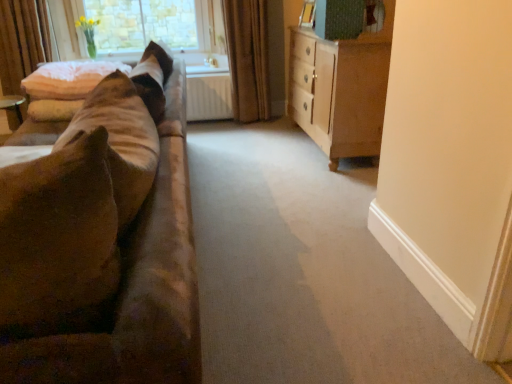
Image resolution: width=512 pixels, height=384 pixels. Find the location of `free location to the left of light brown wood dresser at right`. free location to the left of light brown wood dresser at right is located at coordinates (258, 144).